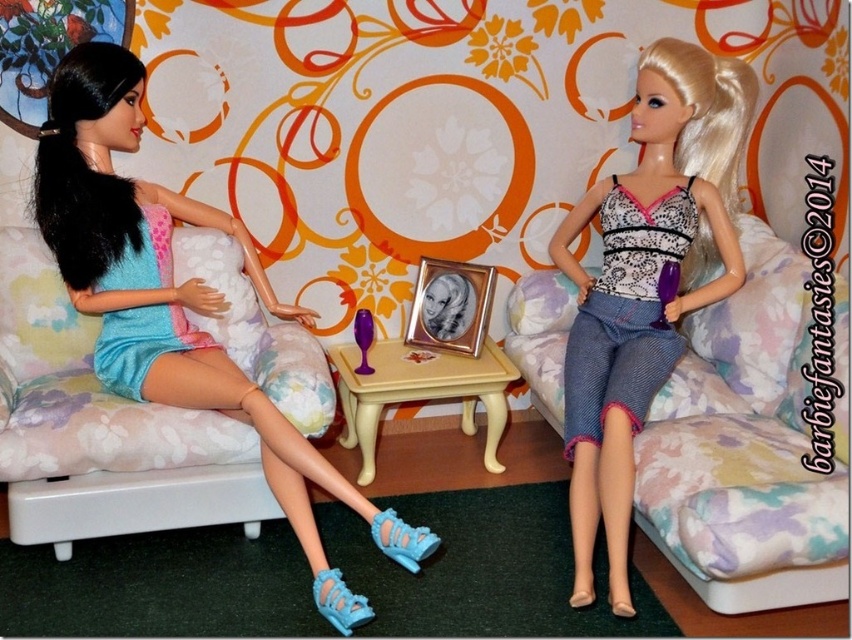
Which of these two, matte blue dress at left or denim shorts at right, stands shorter?

Standing shorter between the two is matte blue dress at left.

How far apart are matte blue dress at left and denim shorts at right?

matte blue dress at left is 1.21 meters away from denim shorts at right.

Looking at this image, who is more forward, (43, 221) or (607, 243)?

Point (43, 221) is more forward.

Where is `matte blue dress at left`? This screenshot has height=640, width=852. matte blue dress at left is located at coordinates (176, 304).

Is floral fabric couch at right above denim shorts at right?

No.

Does floral fabric couch at right come in front of denim shorts at right?

Yes, it is in front of denim shorts at right.

Find the location of a particular element. Image resolution: width=852 pixels, height=640 pixels. floral fabric couch at right is located at coordinates (746, 449).

Locate an element on the screen. This screenshot has width=852, height=640. floral fabric couch at right is located at coordinates (746, 449).

Who is positioned more to the right, floral fabric couch at right or floral fabric couch at left?

floral fabric couch at right is more to the right.

Between point (766, 454) and point (72, 528), which one is positioned in front?

Positioned in front is point (766, 454).

Locate an element on the screen. The height and width of the screenshot is (640, 852). floral fabric couch at right is located at coordinates (746, 449).